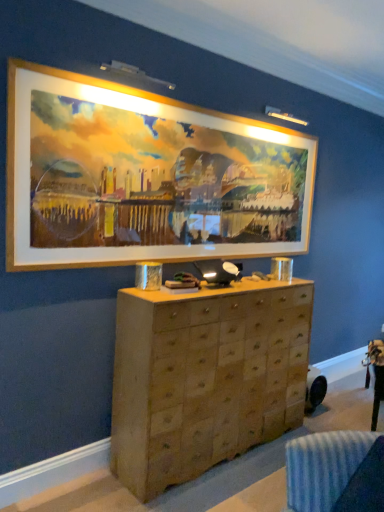
The width and height of the screenshot is (384, 512). What do you see at coordinates (145, 177) in the screenshot?
I see `wooden frame at upper center` at bounding box center [145, 177].

What are the coordinates of `wooden frame at upper center` in the screenshot? It's located at (145, 177).

I want to click on wooden chest of drawers at center, so click(x=205, y=377).

What do you see at coordinates (205, 377) in the screenshot? Image resolution: width=384 pixels, height=512 pixels. I see `wooden chest of drawers at center` at bounding box center [205, 377].

You are a GUI agent. You are given a task and a screenshot of the screen. Output one action in this format:
    pyautogui.click(x=<x>, y=<y>)
    Task: Click on the wooden frame at upper center
    The width and height of the screenshot is (384, 512).
    Given the screenshot: What is the action you would take?
    pyautogui.click(x=145, y=177)

Does wooden chest of drawers at center appear on the left side of wooden frame at upper center?

Incorrect, wooden chest of drawers at center is not on the left side of wooden frame at upper center.

Is wooden chest of drawers at center in front of or behind wooden frame at upper center in the image?

In the image, wooden chest of drawers at center appears behind wooden frame at upper center.

Between point (283, 406) and point (290, 230), which one is positioned in front?

Positioned in front is point (283, 406).

From the image's perspective, which one is positioned higher, wooden chest of drawers at center or wooden frame at upper center?

wooden frame at upper center, from the image's perspective.

From a real-world perspective, is wooden chest of drawers at center physically below wooden frame at upper center?

Yes.

Between wooden chest of drawers at center and wooden frame at upper center, which one has smaller width?

wooden frame at upper center is thinner.

In the scene shown: Considering the sizes of objects wooden chest of drawers at center and wooden frame at upper center in the image provided, who is shorter, wooden chest of drawers at center or wooden frame at upper center?

wooden frame at upper center is shorter.

Is wooden chest of drawers at center bigger or smaller than wooden frame at upper center?

In the image, wooden chest of drawers at center appears to be larger than wooden frame at upper center.

Is wooden frame at upper center a part of wooden chest of drawers at center?

Actually, wooden frame at upper center is outside wooden chest of drawers at center.

Is wooden chest of drawers at center next to wooden frame at upper center?

There is a gap between wooden chest of drawers at center and wooden frame at upper center.

Could you tell me if wooden chest of drawers at center is turned towards wooden frame at upper center?

No, wooden chest of drawers at center is not aimed at wooden frame at upper center.

In order to click on picture frame above the wooden chest of drawers at center (from the image's perspective) in this screenshot , I will do `click(145, 177)`.

Is wooden frame at upper center at the left side of wooden chest of drawers at center?

Correct, you'll find wooden frame at upper center to the left of wooden chest of drawers at center.

Does wooden frame at upper center lie behind wooden chest of drawers at center?

No, it is in front of wooden chest of drawers at center.

Considering the positions of point (145, 96) and point (228, 300), is point (145, 96) closer or farther from the camera than point (228, 300)?

Point (145, 96) is closer to the camera than point (228, 300).

From the image's perspective, is wooden frame at upper center above or below wooden chest of drawers at center?

From the image's perspective, wooden frame at upper center appears above wooden chest of drawers at center.

From a real-world perspective, which object stands above the other?

wooden frame at upper center, from a real-world perspective.

In terms of width, does wooden frame at upper center look wider or thinner when compared to wooden chest of drawers at center?

Clearly, wooden frame at upper center has less width compared to wooden chest of drawers at center.

From the picture: Is wooden frame at upper center taller than wooden chest of drawers at center?

No.

Looking at this image, is wooden frame at upper center smaller than wooden chest of drawers at center?

Yes.

Is wooden frame at upper center completely or partially outside of wooden chest of drawers at center?

Yes, wooden frame at upper center is located beyond the bounds of wooden chest of drawers at center.

Can you see wooden frame at upper center touching wooden chest of drawers at center?

They are not placed beside each other.

Is wooden frame at upper center facing away from wooden chest of drawers at center?

No, wooden frame at upper center's orientation is not away from wooden chest of drawers at center.

The height and width of the screenshot is (512, 384). I want to click on picture frame on the left of wooden chest of drawers at center, so click(145, 177).

Find the location of a particular element. Image resolution: width=384 pixels, height=512 pixels. picture frame that is above the wooden chest of drawers at center (from a real-world perspective) is located at coordinates (145, 177).

Find the location of a particular element. This screenshot has height=512, width=384. picture frame in front of the wooden chest of drawers at center is located at coordinates (145, 177).